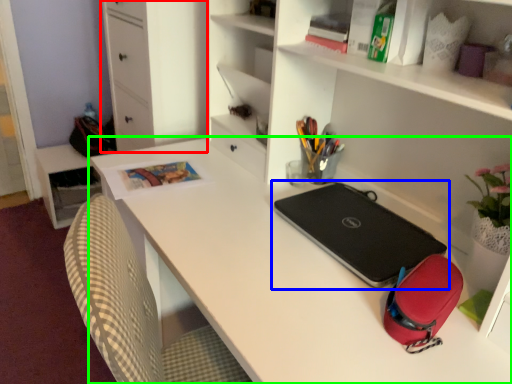
Question: Which is nearer to the file cabinet (highlighted by a red box)? laptop (highlighted by a blue box) or desk (highlighted by a green box).

Choices:
 (A) laptop
 (B) desk

Answer: (B)